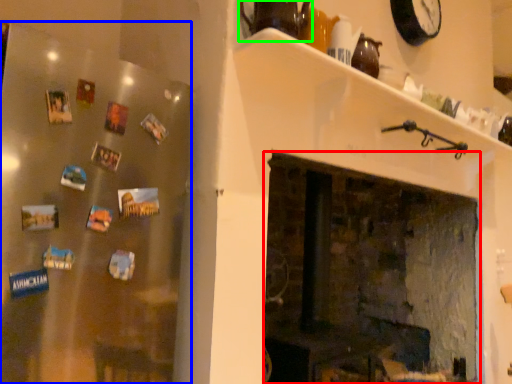
Question: Estimate the real-world distances between objects in this image. Which object is farther from fireplace (highlighted by a red box), fridge (highlighted by a blue box) or tea pot (highlighted by a green box)?

Choices:
 (A) fridge
 (B) tea pot

Answer: (A)